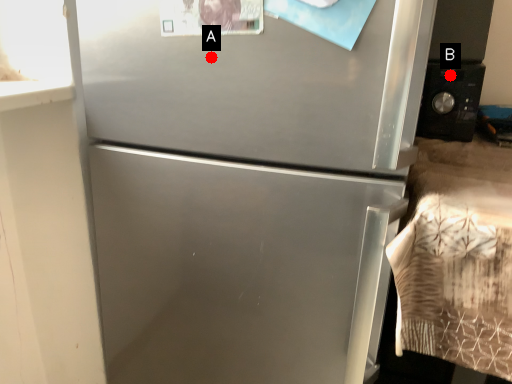
Question: Two points are circled on the image, labeled by A and B beside each circle. Which of the following is the farthest from the observer?

Choices:
 (A) A is further
 (B) B is further

Answer: (B)